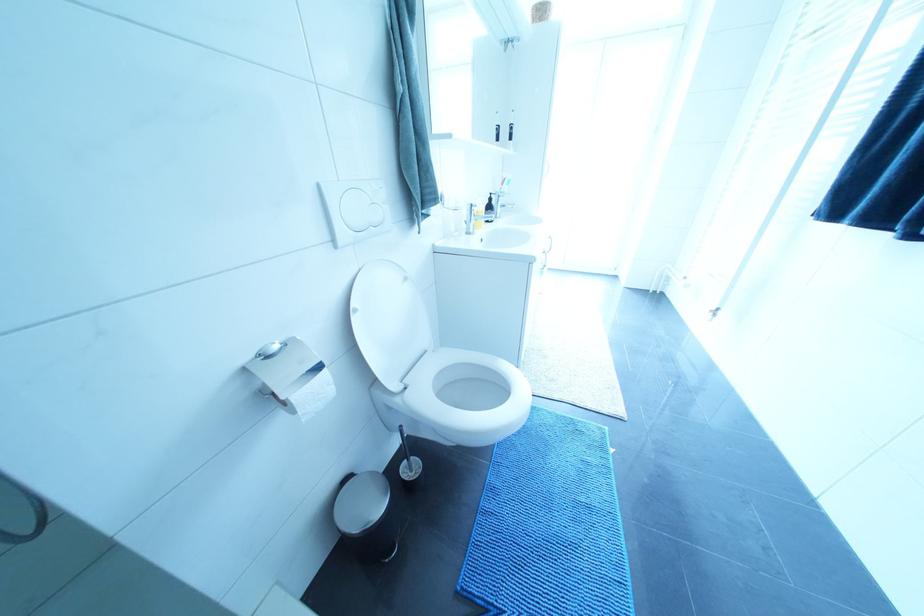
Find the location of a particular element. white flush buttons is located at coordinates (354, 206).